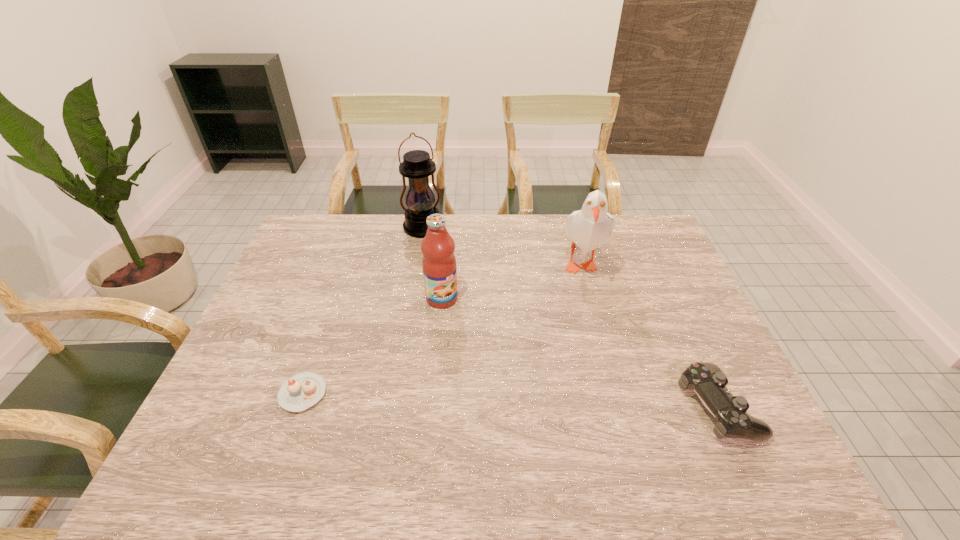
At what (x,y) coordinates should I click in order to perform the action: click on cupcake located at the near edge. Please return your answer as a coordinate pair (x, y). Looking at the image, I should click on (303, 390).

Find the location of a particular element. Image resolution: width=960 pixels, height=540 pixels. control present at the near edge is located at coordinates (708, 381).

At what (x,y) coordinates should I click in order to perform the action: click on object at the left edge. Please return your answer as a coordinate pair (x, y). Looking at the image, I should click on (303, 390).

This screenshot has width=960, height=540. I want to click on object at the right edge, so click(x=708, y=381).

Where is `object situated at the near left corner`? The width and height of the screenshot is (960, 540). object situated at the near left corner is located at coordinates 303,390.

This screenshot has height=540, width=960. In order to click on object situated at the near right corner in this screenshot , I will do `click(708, 381)`.

The width and height of the screenshot is (960, 540). Identify the location of vacant space at the far edge. (521, 220).

In the image, there is a desktop. At what (x,y) coordinates should I click in order to perform the action: click on vacant space at the near edge. Please return your answer as a coordinate pair (x, y). The height and width of the screenshot is (540, 960). Looking at the image, I should click on (516, 410).

At what (x,y) coordinates should I click in order to perform the action: click on vacant space at the left edge of the desktop. Please return your answer as a coordinate pair (x, y). Looking at the image, I should click on (263, 345).

Where is `vacant space at the right edge of the desktop`? This screenshot has height=540, width=960. vacant space at the right edge of the desktop is located at coordinates (694, 310).